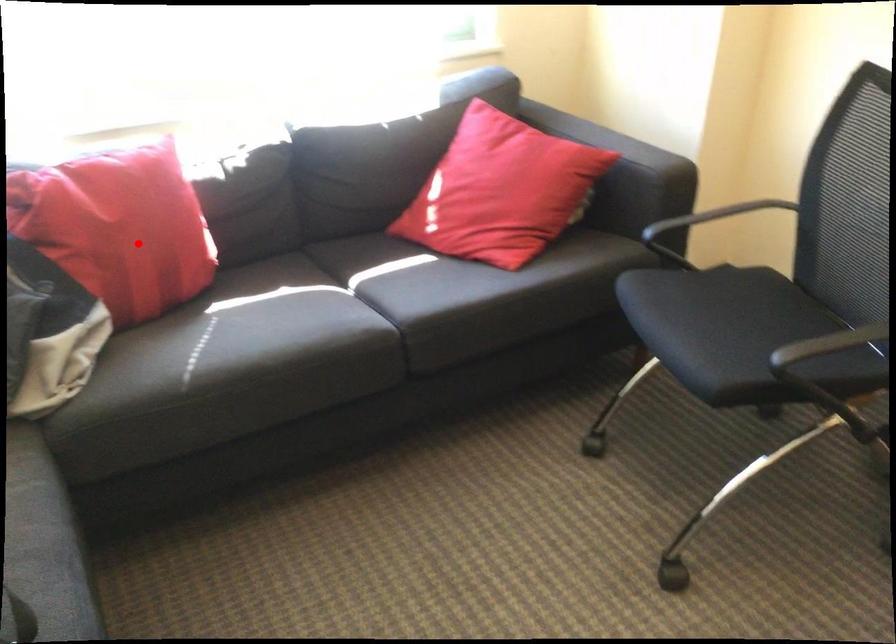
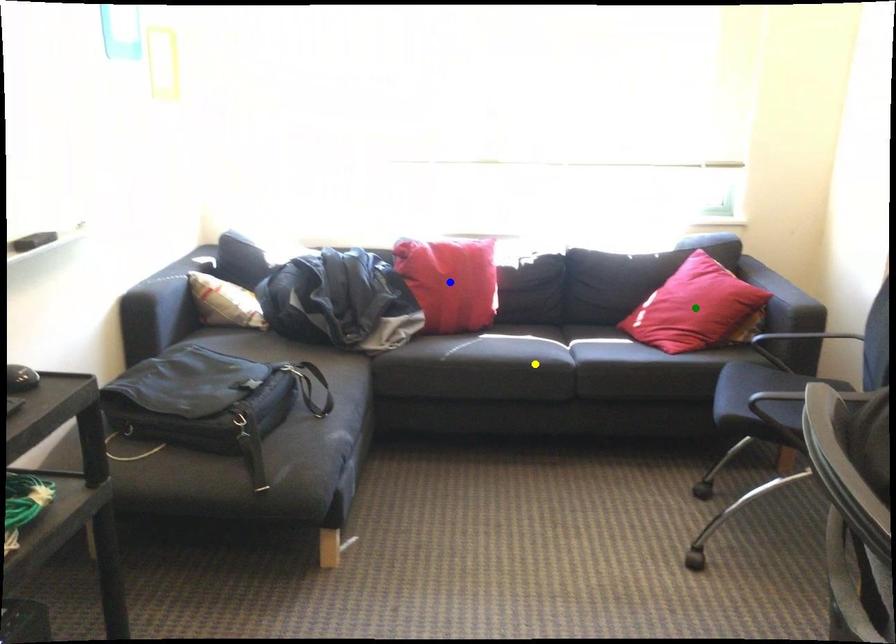
Question: I am providing you with two images of the same scene from different viewpoints. A red point is marked on the first image. You are given multiple points on the second image. Which point in image 2 represents the same 3d spot as the red point in image 1?

Choices:
 (A) yellow point
 (B) green point
 (C) blue point

Answer: (C)